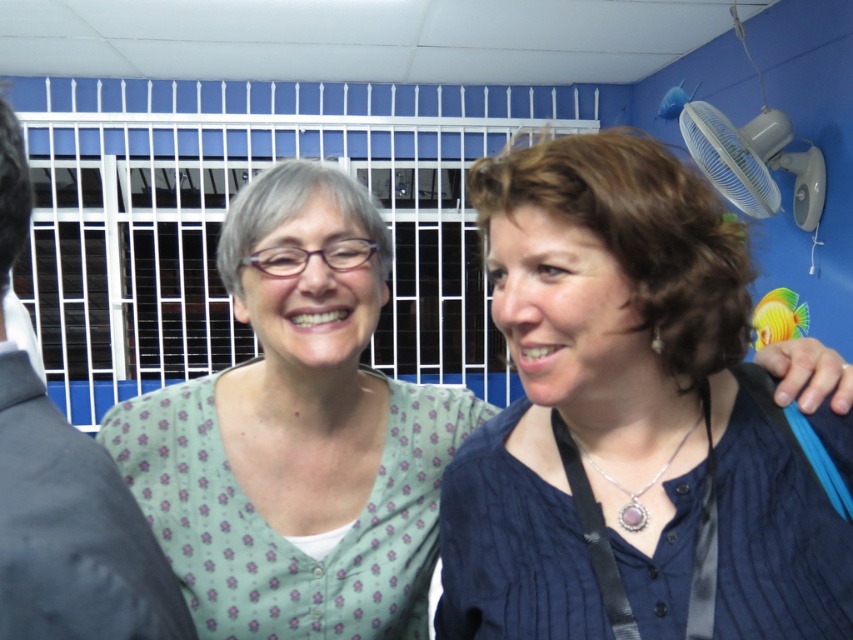
Can you confirm if brown matte hair at center is smaller than gray matte hair at center?

No.

Is point (741, 262) closer to viewer compared to point (358, 212)?

Yes, it is in front of point (358, 212).

What do you see at coordinates (640, 236) in the screenshot? I see `brown matte hair at center` at bounding box center [640, 236].

Identify the location of brown matte hair at center. (640, 236).

Who is positioned more to the right, gray matte hair at center or black matte hair at left?

From the viewer's perspective, gray matte hair at center appears more on the right side.

Between gray matte hair at center and black matte hair at left, which one appears on the left side from the viewer's perspective?

From the viewer's perspective, black matte hair at left appears more on the left side.

Find the location of a particular element. gray matte hair at center is located at coordinates (293, 212).

Is the position of blue textured blouse at center less distant than that of white plastic fan at upper right?

Yes, it is.

Does point (590, 253) lie behind point (804, 164)?

No, it is in front of (804, 164).

The height and width of the screenshot is (640, 853). What are the coordinates of `blue textured blouse at center` in the screenshot? It's located at (627, 417).